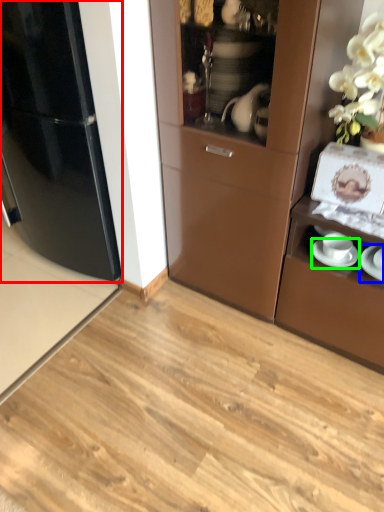
Question: Which is nearer to the refrigerator (highlighted by a red box)? saucer (highlighted by a blue box) or saucer (highlighted by a green box).

Choices:
 (A) saucer
 (B) saucer

Answer: (B)